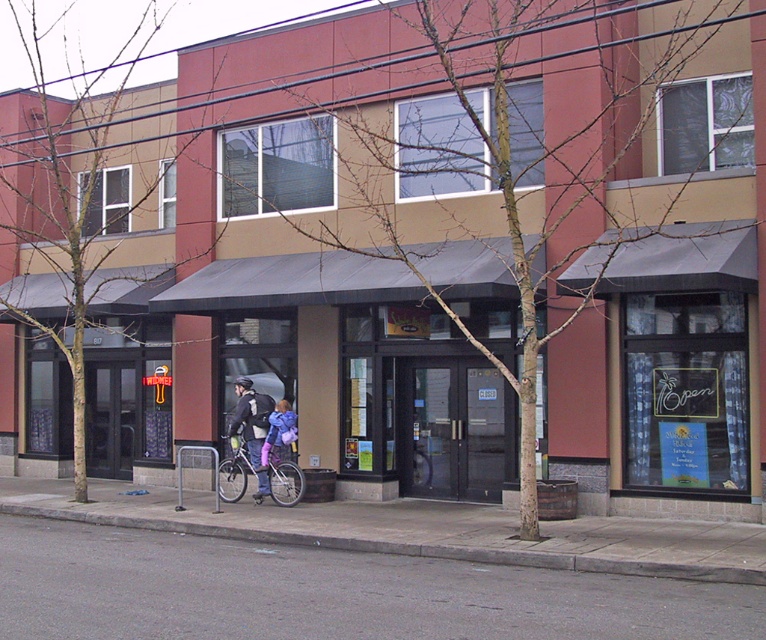
Question: Estimate the real-world distances between objects in this image. Which object is closer to the gray asphalt pavement at lower center?

Choices:
 (A) purple fabric bag at center
 (B) matte black jacket at center

Answer: (A)

Question: Which of the following is the closest to the observer?

Choices:
 (A) gray asphalt pavement at lower center
 (B) gray concrete pavement at lower center
 (C) purple fabric bag at center
 (D) silver metallic bicycle at center

Answer: (A)

Question: Is gray asphalt pavement at lower center behind purple fabric bag at center?

Choices:
 (A) no
 (B) yes

Answer: (A)

Question: Does gray asphalt pavement at lower center have a lesser width compared to gray concrete pavement at lower center?

Choices:
 (A) yes
 (B) no

Answer: (A)

Question: Which point appears closest to the camera in this image?

Choices:
 (A) (417, 554)
 (B) (244, 480)
 (C) (254, 433)
 (D) (283, 397)

Answer: (A)

Question: Can you confirm if gray asphalt pavement at lower center is positioned to the right of silver metallic bicycle at center?

Choices:
 (A) yes
 (B) no

Answer: (A)